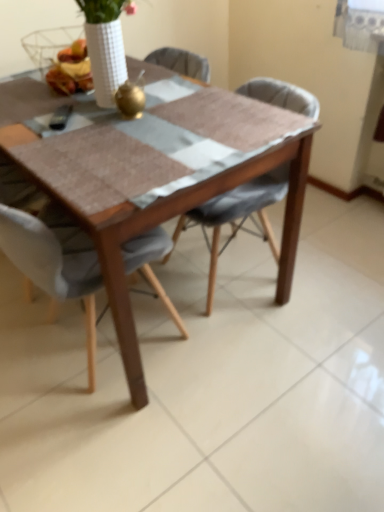
Question: Should I look upward or downward to see textured gray chair at center, the second chair from the left?

Choices:
 (A) up
 (B) down

Answer: (A)

Question: Should I look upward or downward to see light gray fabric chair at center, which appears as the second chair when viewed from the right?

Choices:
 (A) up
 (B) down

Answer: (B)

Question: Is textured gray chair at center, the 1th chair in the right-to-left sequence, taller than light gray fabric chair at center, placed as the first chair when sorted from left to right?

Choices:
 (A) yes
 (B) no

Answer: (B)

Question: Does textured gray chair at center, the second chair from the left, have a smaller size compared to light gray fabric chair at center, which appears as the second chair when viewed from the right?

Choices:
 (A) yes
 (B) no

Answer: (A)

Question: Is textured gray chair at center, the 1th chair in the right-to-left sequence, oriented away from light gray fabric chair at center, which appears as the second chair when viewed from the right?

Choices:
 (A) yes
 (B) no

Answer: (B)

Question: Considering the relative sizes of textured gray chair at center, the 1th chair in the right-to-left sequence, and light gray fabric chair at center, which appears as the second chair when viewed from the right, in the image provided, is textured gray chair at center, the 1th chair in the right-to-left sequence, wider than light gray fabric chair at center, which appears as the second chair when viewed from the right,?

Choices:
 (A) no
 (B) yes

Answer: (B)

Question: Does textured gray chair at center, the 1th chair in the right-to-left sequence, have a lesser height compared to light gray fabric chair at center, which appears as the second chair when viewed from the right?

Choices:
 (A) yes
 (B) no

Answer: (A)

Question: Would you say light gray fabric chair at center, which appears as the second chair when viewed from the right, is part of textured gray chair at center, the 1th chair in the right-to-left sequence,'s contents?

Choices:
 (A) no
 (B) yes

Answer: (A)

Question: Considering the relative sizes of matte yellow cheese at upper center and textured gray chair at center, the 1th chair in the right-to-left sequence, in the image provided, is matte yellow cheese at upper center shorter than textured gray chair at center, the 1th chair in the right-to-left sequence,?

Choices:
 (A) no
 (B) yes

Answer: (B)

Question: From the image's perspective, does matte yellow cheese at upper center appear lower than textured gray chair at center, the 1th chair in the right-to-left sequence?

Choices:
 (A) no
 (B) yes

Answer: (A)

Question: From a real-world perspective, is matte yellow cheese at upper center physically above textured gray chair at center, the second chair from the left?

Choices:
 (A) no
 (B) yes

Answer: (B)

Question: Is matte yellow cheese at upper center not close to textured gray chair at center, the second chair from the left?

Choices:
 (A) yes
 (B) no

Answer: (B)

Question: Can you confirm if matte yellow cheese at upper center is thinner than textured gray chair at center, the second chair from the left?

Choices:
 (A) yes
 (B) no

Answer: (A)

Question: Is matte yellow cheese at upper center beside textured gray chair at center, the 1th chair in the right-to-left sequence?

Choices:
 (A) yes
 (B) no

Answer: (B)

Question: Is wooden table at center bigger than light gray fabric chair at center, which appears as the second chair when viewed from the right?

Choices:
 (A) yes
 (B) no

Answer: (A)